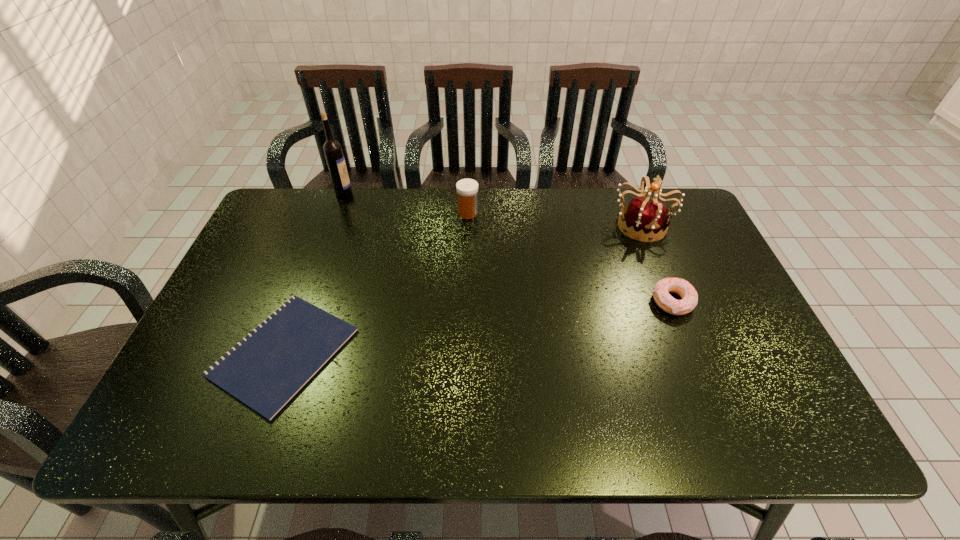
This screenshot has width=960, height=540. Find the location of `unoccupied area between the fourth tallest object and the shortest object`. unoccupied area between the fourth tallest object and the shortest object is located at coordinates (478, 327).

Where is `free space between the second tallest object and the farthest object`? free space between the second tallest object and the farthest object is located at coordinates (492, 208).

Identify the location of free area in between the fourth tallest object and the farthest object. (508, 247).

Where is `vacant area that lies between the third tallest object and the doughnut`? The height and width of the screenshot is (540, 960). vacant area that lies between the third tallest object and the doughnut is located at coordinates (570, 258).

Identify the location of free space between the tiara and the doughnut. The height and width of the screenshot is (540, 960). (657, 263).

Locate an element on the screen. free spot between the shortest object and the doughnut is located at coordinates (478, 327).

Image resolution: width=960 pixels, height=540 pixels. In order to click on free space between the shortest object and the third object from left to right in this screenshot , I will do `click(376, 283)`.

This screenshot has height=540, width=960. Find the location of `free space between the third tallest object and the doughnut`. free space between the third tallest object and the doughnut is located at coordinates (570, 258).

Locate an element on the screen. This screenshot has width=960, height=540. object that stands as the third closest to the second tallest object is located at coordinates (265, 370).

Identify which object is located as the second nearest to the medicine. Please provide its 2D coordinates. Your answer should be formatted as a tuple, i.e. [(x, y)], where the tuple contains the x and y coordinates of a point satisfying the conditions above.

[(265, 370)]